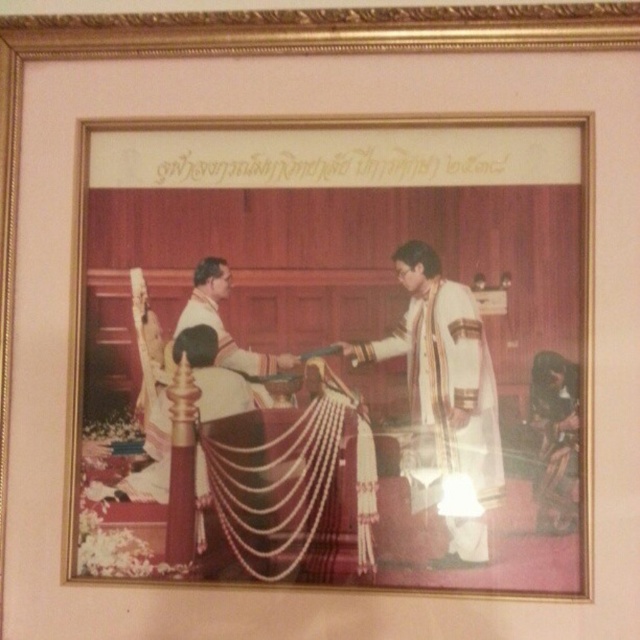
You are an art conservator examining the framed photograph. You need to clean both the matte gold picture frame at center and the white silk dhoti at center. Which object should you clean first if you want to start with the one closer to you?

The matte gold picture frame at center is closer to the viewer than the white silk dhoti at center, so you should clean the matte gold picture frame at center first.